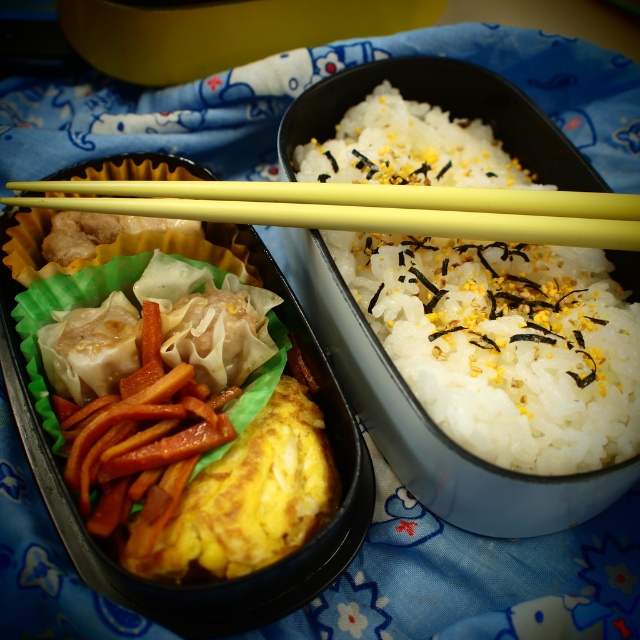
Question: Does yellow soft omelette at center have a lesser width compared to yellow plastic chopsticks at center?

Choices:
 (A) no
 (B) yes

Answer: (B)

Question: Which object is farther from the camera taking this photo?

Choices:
 (A) white rice at center
 (B) yellow soft omelette at center
 (C) yellow plastic chopsticks at center

Answer: (C)

Question: Does white rice at center have a lesser width compared to yellow plastic chopsticks at center?

Choices:
 (A) yes
 (B) no

Answer: (A)

Question: Observing the image, what is the correct spatial positioning of yellow soft omelette at center in reference to yellow plastic chopsticks at center?

Choices:
 (A) below
 (B) above

Answer: (A)

Question: Among these objects, which one is nearest to the camera?

Choices:
 (A) yellow soft omelette at center
 (B) white rice at center

Answer: (A)

Question: Which object is closer to the camera taking this photo?

Choices:
 (A) white rice at center
 (B) yellow soft omelette at center
 (C) yellow plastic chopsticks at center

Answer: (B)